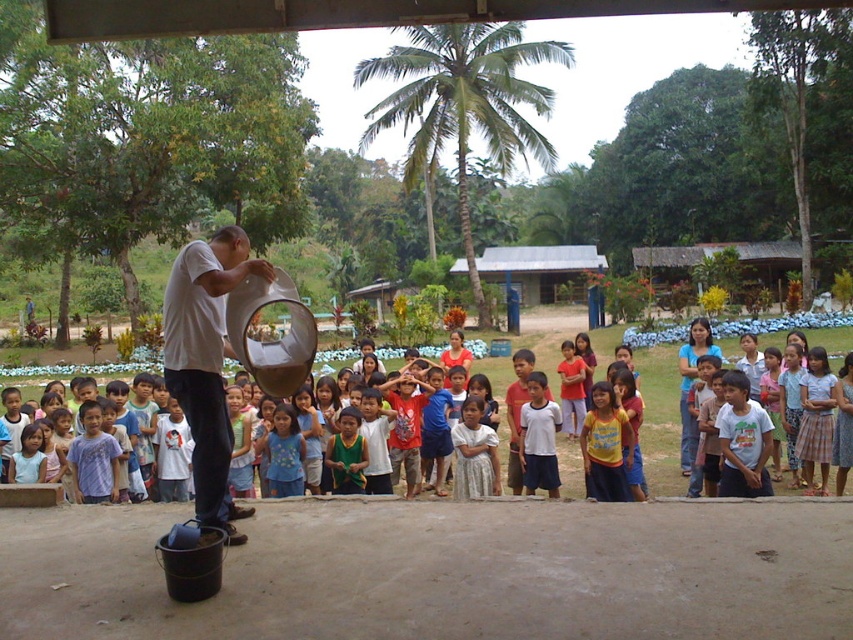
Question: Is yellow cotton shirt at center positioned at the back of white cotton shirt at center?

Choices:
 (A) yes
 (B) no

Answer: (B)

Question: Can you confirm if yellow cotton shirt at center is bigger than white cotton shirt at center?

Choices:
 (A) no
 (B) yes

Answer: (A)

Question: Which object is the farthest from the white matte bucket at center?

Choices:
 (A) white cotton shirt at center
 (B) yellow cotton shirt at center

Answer: (B)

Question: Considering the real-world distances, which object is farthest from the white matte bucket at center?

Choices:
 (A) white cotton shirt at center
 (B) yellow cotton shirt at center

Answer: (B)

Question: Can you confirm if white matte bucket at center is thinner than yellow cotton shirt at center?

Choices:
 (A) no
 (B) yes

Answer: (A)

Question: Among these objects, which one is nearest to the camera?

Choices:
 (A) white cotton shirt at center
 (B) white matte bucket at center
 (C) yellow cotton shirt at center

Answer: (B)